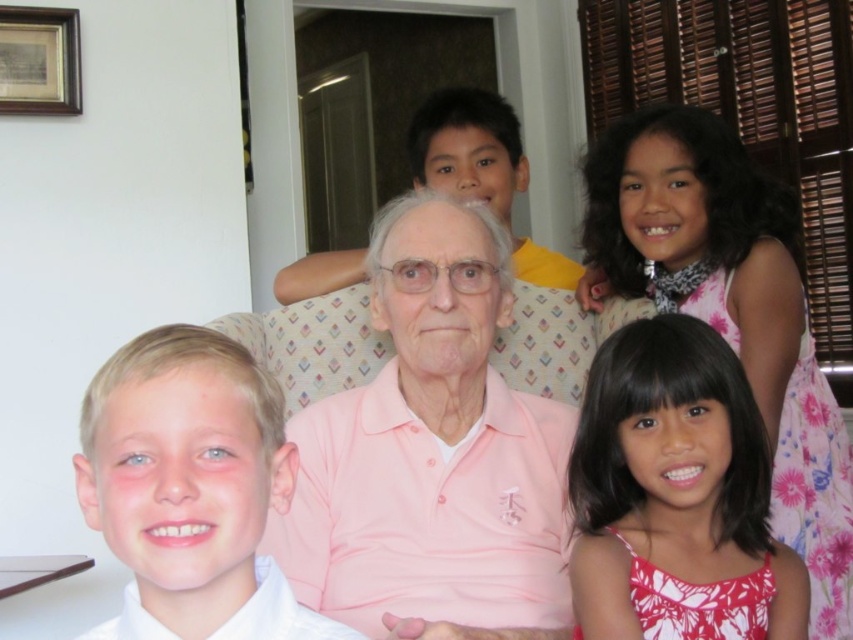
Question: Does pink cotton shirt at center appear on the right side of pink floral dress at lower right?

Choices:
 (A) no
 (B) yes

Answer: (A)

Question: Based on their relative distances, which object is nearer to the pink cotton shirt at center?

Choices:
 (A) wooden picture frame at upper left
 (B) pink floral dress at lower right
 (C) blonde hair boy at left

Answer: (B)

Question: Does pink cotton shirt at center appear under pink floral dress at lower right?

Choices:
 (A) no
 (B) yes

Answer: (A)

Question: Which of the following is the farthest from the observer?

Choices:
 (A) pink floral dress at lower right
 (B) pink cotton shirt at center
 (C) blonde hair boy at left
 (D) wooden picture frame at upper left

Answer: (D)

Question: Which object appears closest to the camera in this image?

Choices:
 (A) wooden picture frame at upper left
 (B) blonde hair boy at left
 (C) pink floral dress at lower right

Answer: (B)

Question: Does pink cotton shirt at center have a larger size compared to wooden picture frame at upper left?

Choices:
 (A) yes
 (B) no

Answer: (A)